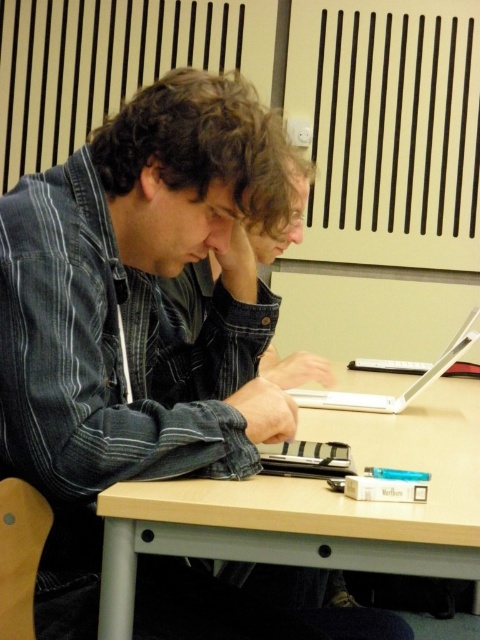
Which is more to the left, light brown wood table at center or white plastic laptop at center?

From the viewer's perspective, light brown wood table at center appears more on the left side.

Which is more to the right, light brown wood table at center or white plastic laptop at center?

white plastic laptop at center

Locate an element on the screen. Image resolution: width=480 pixels, height=640 pixels. light brown wood table at center is located at coordinates (314, 506).

The image size is (480, 640). Find the location of `light brown wood table at center`. light brown wood table at center is located at coordinates (314, 506).